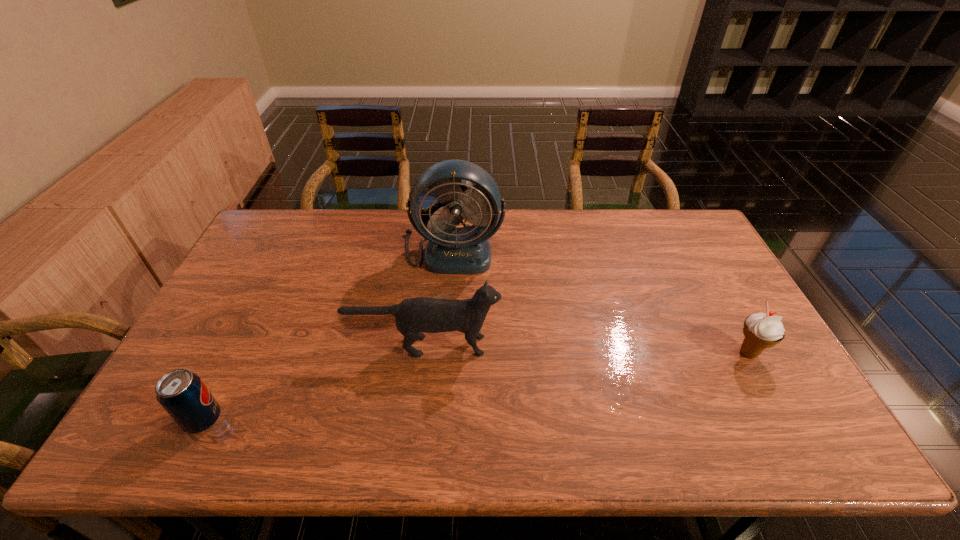
I want to click on vacant space at the far right corner of the desktop, so click(x=700, y=232).

Image resolution: width=960 pixels, height=540 pixels. I want to click on free space between the rightmost object and the third shortest object, so click(x=587, y=349).

I want to click on blank region between the icecream and the tallest object, so click(601, 302).

This screenshot has width=960, height=540. Find the location of `free space between the tallest object and the rightmost object`. free space between the tallest object and the rightmost object is located at coordinates (601, 302).

Where is `free space between the tallest object and the nearest object`? free space between the tallest object and the nearest object is located at coordinates (328, 335).

Where is `free space between the leftmost object and the icecream`? The width and height of the screenshot is (960, 540). free space between the leftmost object and the icecream is located at coordinates click(476, 386).

Identify the location of vacant space that's between the rightmost object and the cat. (587, 349).

At what (x,y) coordinates should I click in order to perform the action: click on empty space between the soda can and the farthest object. Please return your answer as a coordinate pair (x, y). Looking at the image, I should click on (328, 335).

Identify the location of empty space that is in between the icecream and the tallest object. The image size is (960, 540). (601, 302).

Identify the location of free space between the tallest object and the cat. (439, 298).